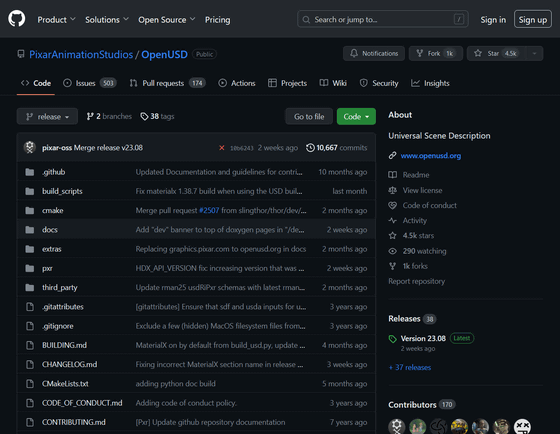
This screenshot has height=434, width=560. I want to click on folders, so click(56, 173), click(57, 193), click(50, 214), click(49, 229), click(49, 248), click(49, 268), click(56, 286).